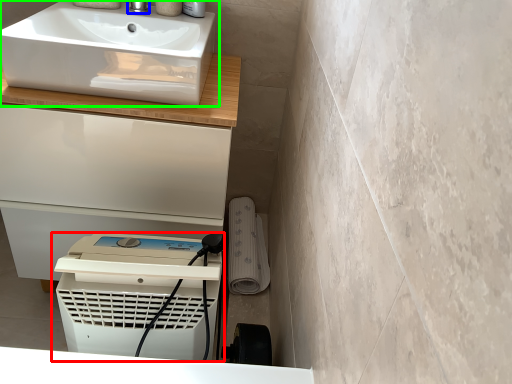
Question: Considering the real-world distances, which object is farthest from home appliance (highlighted by a red box)? tap (highlighted by a blue box) or sink (highlighted by a green box)?

Choices:
 (A) tap
 (B) sink

Answer: (A)